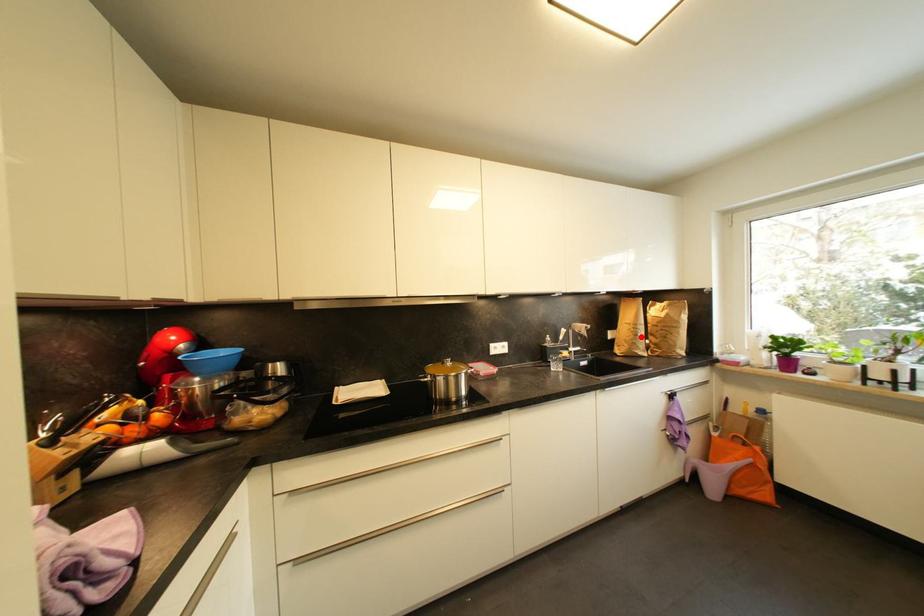
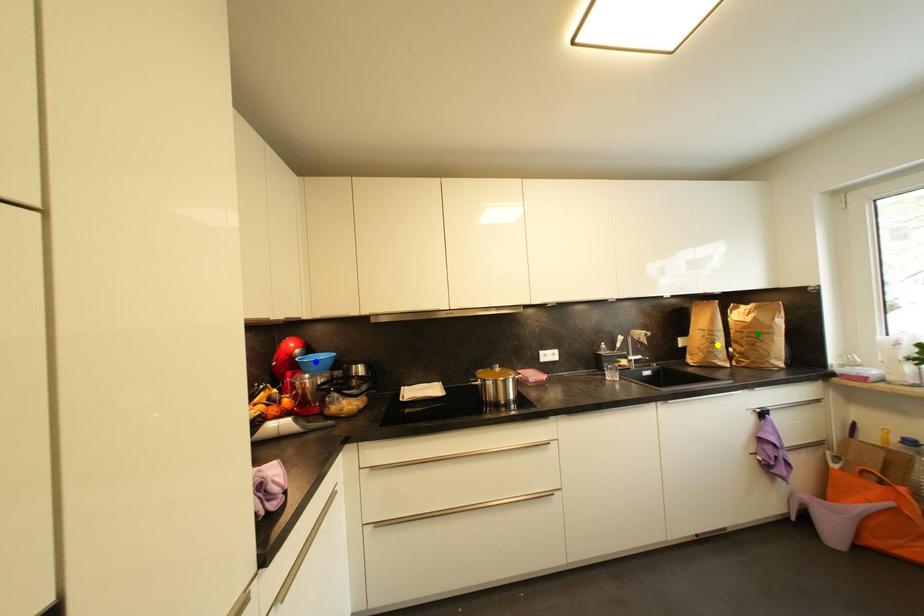
Question: I am providing you with two images of the same scene from different viewpoints. A red point is marked on the first image. You are given multiple points on the second image. In image 2, which mark is for the same physical point as the one in image 1?

Choices:
 (A) blue point
 (B) yellow point
 (C) green point

Answer: (B)